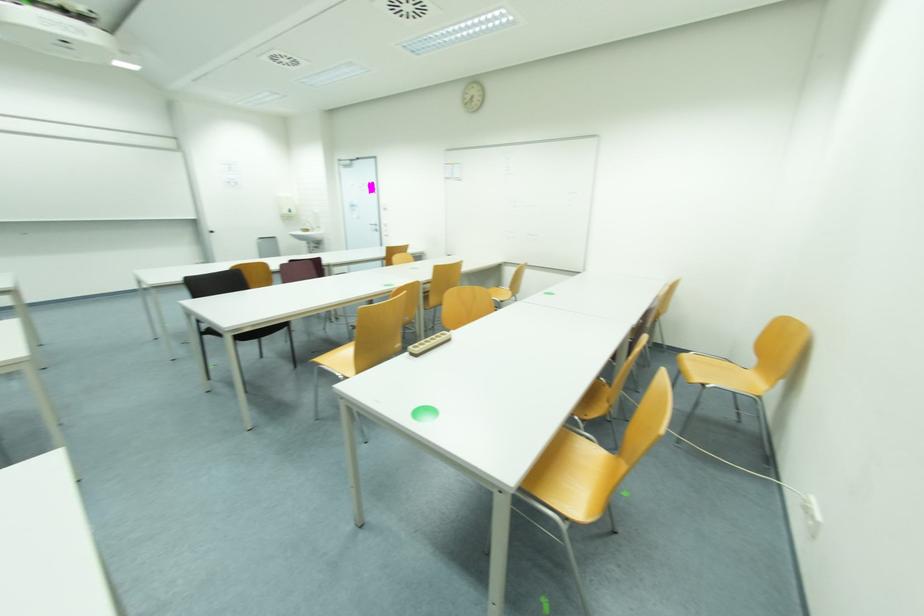
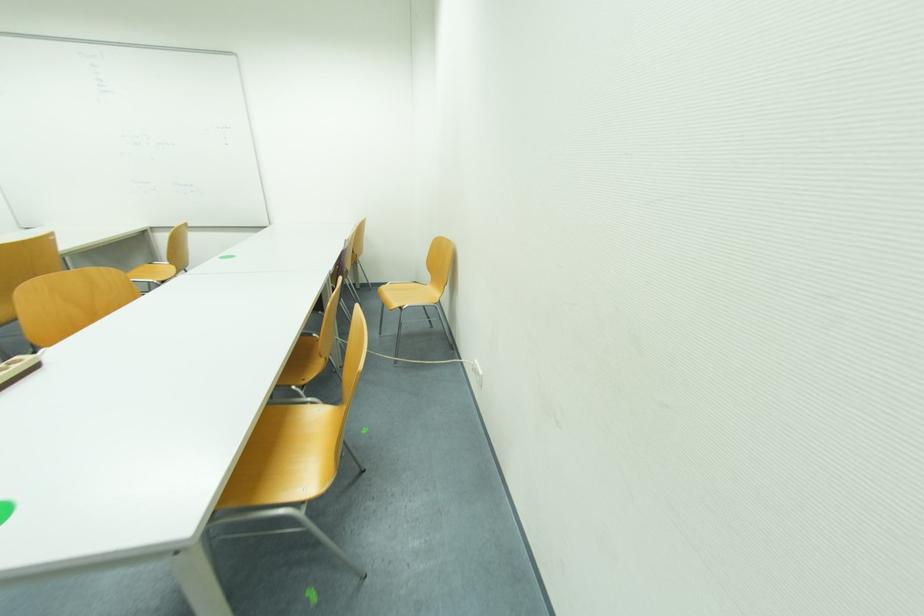
Question: Based on the continuous images, in which direction is the camera rotating? Reply with the corresponding letter.

Choices:
 (A) Left
 (B) Right
 (C) Up
 (D) Down

Answer: (B)